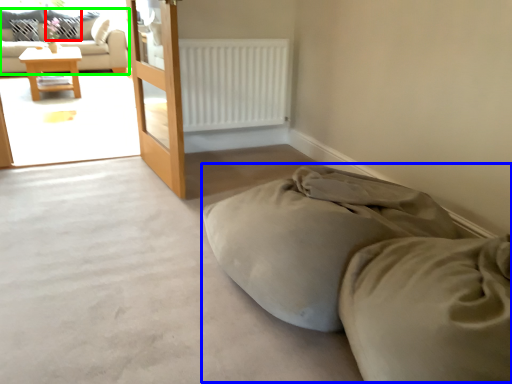
Question: Which object is the closest to the pillow (highlighted by a red box)? Choose among these: bed (highlighted by a blue box) or studio couch (highlighted by a green box).

Choices:
 (A) bed
 (B) studio couch

Answer: (B)